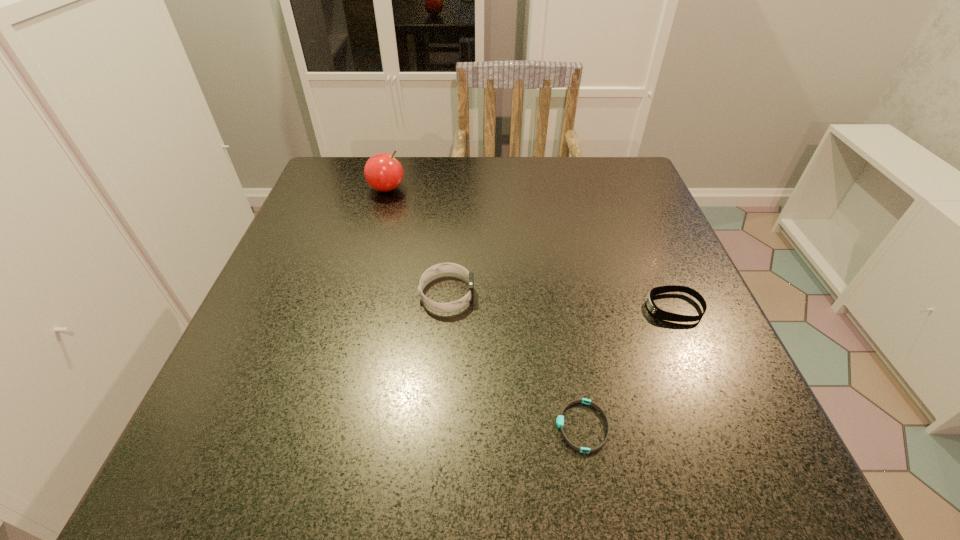
Locate an element on the screen. The image size is (960, 540). the farthest object is located at coordinates (384, 173).

Locate an element on the screen. This screenshot has height=540, width=960. apple is located at coordinates (384, 173).

Where is `the tallest wristband`? Image resolution: width=960 pixels, height=540 pixels. the tallest wristband is located at coordinates (440, 268).

This screenshot has height=540, width=960. I want to click on the third object from right to left, so click(440, 268).

You are a GUI agent. You are given a task and a screenshot of the screen. Output one action in this format:
    pyautogui.click(x=<x>, y=<y>)
    Task: Click on the second tallest wristband
    Image resolution: width=960 pixels, height=540 pixels.
    Given the screenshot: What is the action you would take?
    (657, 312)

Where is `the second shortest object`? the second shortest object is located at coordinates (657, 312).

You are a GUI agent. You are given a task and a screenshot of the screen. Output one action in this format:
    pyautogui.click(x=<x>, y=<y>)
    Task: Click on the nearest object
    This screenshot has height=540, width=960.
    Given the screenshot: What is the action you would take?
    pyautogui.click(x=560, y=419)

Identify the location of the second wristband from left to right. (560, 419).

The image size is (960, 540). Identify the location of vacant space located on the right of the tallest object. (556, 189).

In order to click on free region located on the outer surface of the second tallest object in this screenshot , I will do `click(570, 294)`.